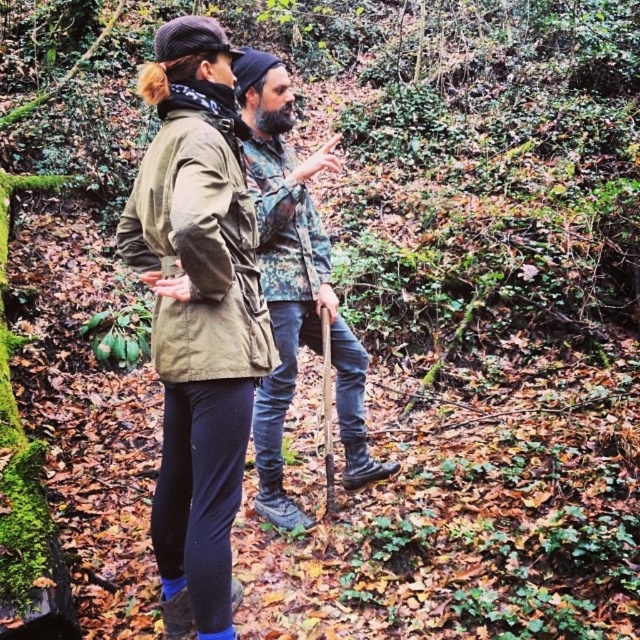
Is matte khaki jacket at center positioned at the back of camouflage fabric shirt at center?

That is False.

Locate an element on the screen. The image size is (640, 640). matte khaki jacket at center is located at coordinates (196, 316).